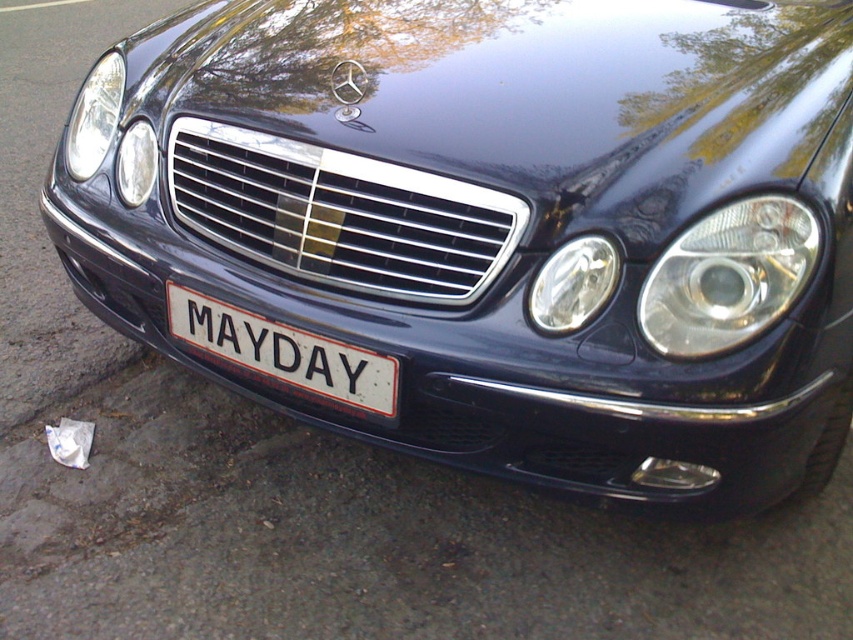
Is point (68, 144) positioned before point (131, 163)?

That is False.

Between matte black headlight at left and matte silver headlight at left, which one is positioned higher?

Positioned higher is matte black headlight at left.

Is point (91, 67) positioned behind point (155, 157)?

Yes, it is behind point (155, 157).

You are a GUI agent. You are given a task and a screenshot of the screen. Output one action in this format:
    pyautogui.click(x=<x>, y=<y>)
    Task: Click on the matte black headlight at left
    The image size is (853, 640).
    Given the screenshot: What is the action you would take?
    pyautogui.click(x=94, y=116)

Is clear plastic headlight at right thinner than white matte license plate at center?

Indeed, clear plastic headlight at right has a lesser width compared to white matte license plate at center.

Does clear plastic headlight at right appear over white matte license plate at center?

Yes, clear plastic headlight at right is above white matte license plate at center.

Between point (693, 296) and point (233, 349), which one is positioned behind?

Point (233, 349)

Identify the location of clear plastic headlight at right. The width and height of the screenshot is (853, 640). (728, 276).

Does clear plastic headlight at center-left come in front of matte black headlight at left?

Yes, it is.

Does point (604, 256) come closer to viewer compared to point (74, 168)?

Yes.

Where is `clear plastic headlight at center-left`? This screenshot has width=853, height=640. clear plastic headlight at center-left is located at coordinates coord(573,284).